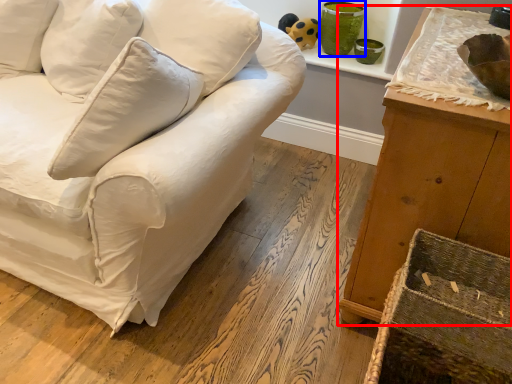
Question: Which of the following is the closest to the observer, furniture (highlighted by a red box) or glass vase (highlighted by a blue box)?

Choices:
 (A) furniture
 (B) glass vase

Answer: (A)